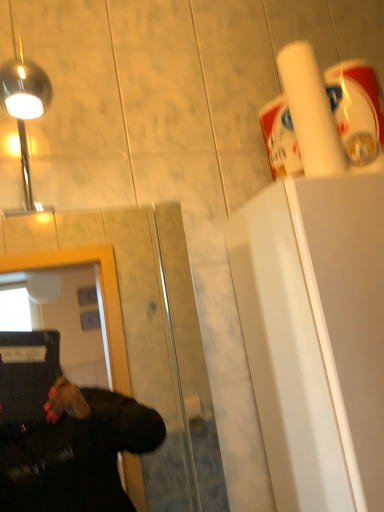
Question: Looking at their shapes, would you say white matte paper towel at upper right is wider or thinner than polished chrome light at upper left?

Choices:
 (A) thin
 (B) wide

Answer: (A)

Question: Considering the relative positions of white matte paper towel at upper right and polished chrome light at upper left in the image provided, is white matte paper towel at upper right to the left or to the right of polished chrome light at upper left?

Choices:
 (A) left
 (B) right

Answer: (B)

Question: Considering the real-world distances, which object is closest to the white matte paper towel at upper right?

Choices:
 (A) polished chrome light at upper left
 (B) transparent glass door at center

Answer: (A)

Question: Considering the real-world distances, which object is farthest from the white matte paper towel at upper right?

Choices:
 (A) polished chrome light at upper left
 (B) transparent glass door at center

Answer: (B)